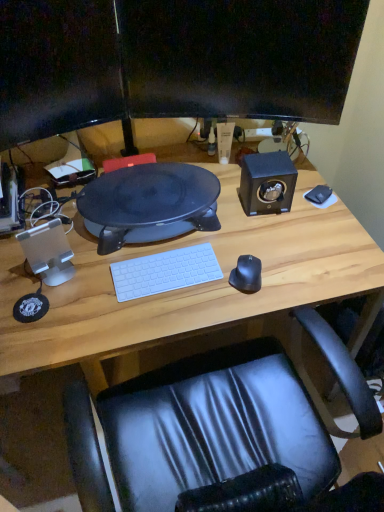
Identify the location of vacant area that is situated to the right of black matte speaker at upper right, the 1th speaker when ordered from top to bottom. Image resolution: width=384 pixels, height=512 pixels. (320, 217).